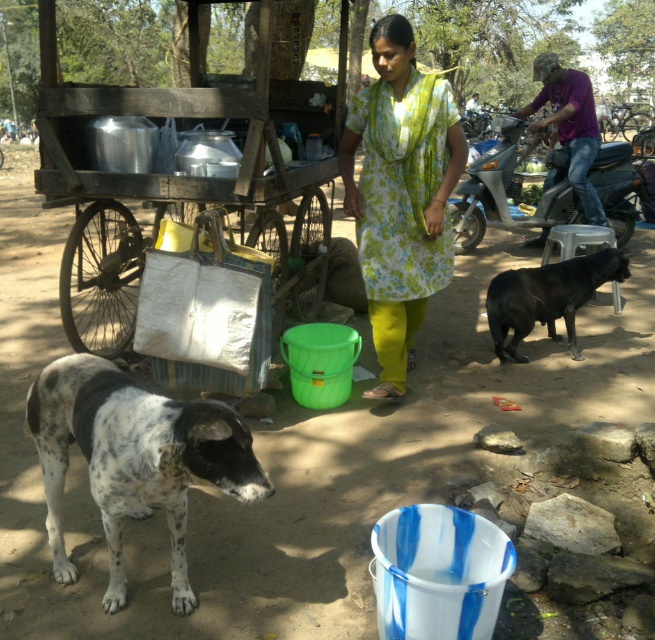
Between speckled fur dog at lower left and metallic silver motorcycle at right, which one appears on the right side from the viewer's perspective?

Positioned to the right is metallic silver motorcycle at right.

Is point (103, 477) closer to viewer compared to point (496, 170)?

Yes, point (103, 477) is closer to viewer.

Find the location of `speckled fur dog at lower left`. speckled fur dog at lower left is located at coordinates (134, 460).

Does green plastic bucket at center lie behind speckled fur dog at lower left?

Yes, it is.

Is green plastic bucket at center shorter than speckled fur dog at lower left?

Indeed, green plastic bucket at center has a lesser height compared to speckled fur dog at lower left.

Is point (457, 474) positioned before point (66, 561)?

That is False.

Where is `green plastic bucket at center`? This screenshot has width=655, height=640. green plastic bucket at center is located at coordinates (291, 456).

Who is more forward, (121, 444) or (468, 108)?

Point (121, 444) is more forward.

Which of these two, speckled fur dog at lower left or light green floral dress at center, stands shorter?

Standing shorter between the two is light green floral dress at center.

Is point (195, 476) positioned in front of point (468, 109)?

Yes, point (195, 476) is in front of point (468, 109).

Where is `speckled fur dog at lower left`? The image size is (655, 640). speckled fur dog at lower left is located at coordinates (134, 460).